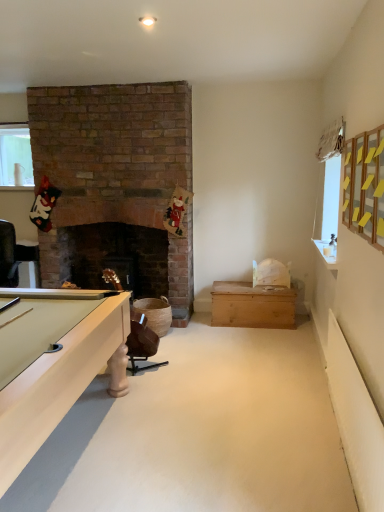
Find the location of a particular element. The width and height of the screenshot is (384, 512). free location in front of wooden chest at center is located at coordinates (254, 334).